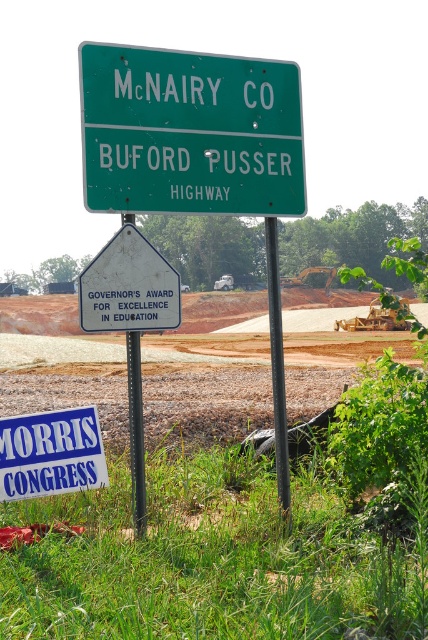
You are standing at the origin point in the image. Which direction should you move to reach the white plastic sign at center?

The white plastic sign at center is located at coordinates point (x=128, y=288), so you should move northeast to reach it.

You are a driver passing by the roadside scene. You notice two signs ahead. The first is a white plastic sign at center and the second is a black metal signpost at center. Which of these two signs is bigger?

The white plastic sign at center is larger than the black metal signpost at center according to the description.